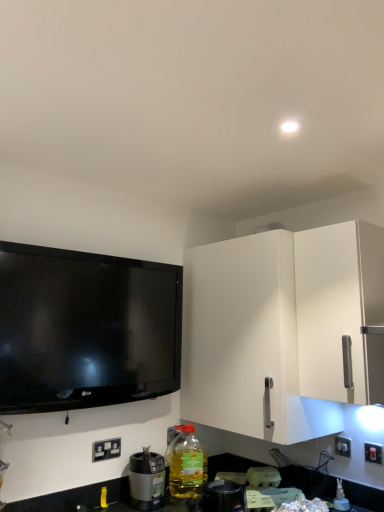
In order to click on blank space situated above metallic silver blender at lower center, the 2th appliance from the left (from a real-world perspective) in this screenshot , I will do `click(223, 484)`.